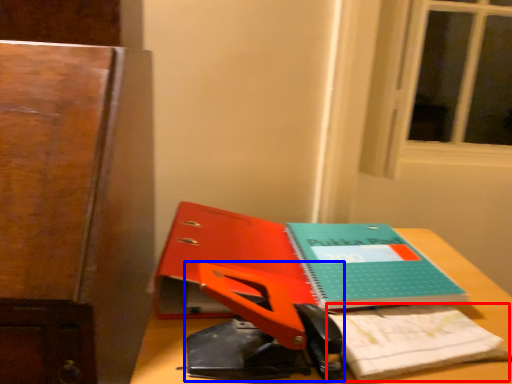
Question: Which of the following is the closest to the observer, notepad (highlighted by a red box) or scissors (highlighted by a blue box)?

Choices:
 (A) notepad
 (B) scissors

Answer: (B)